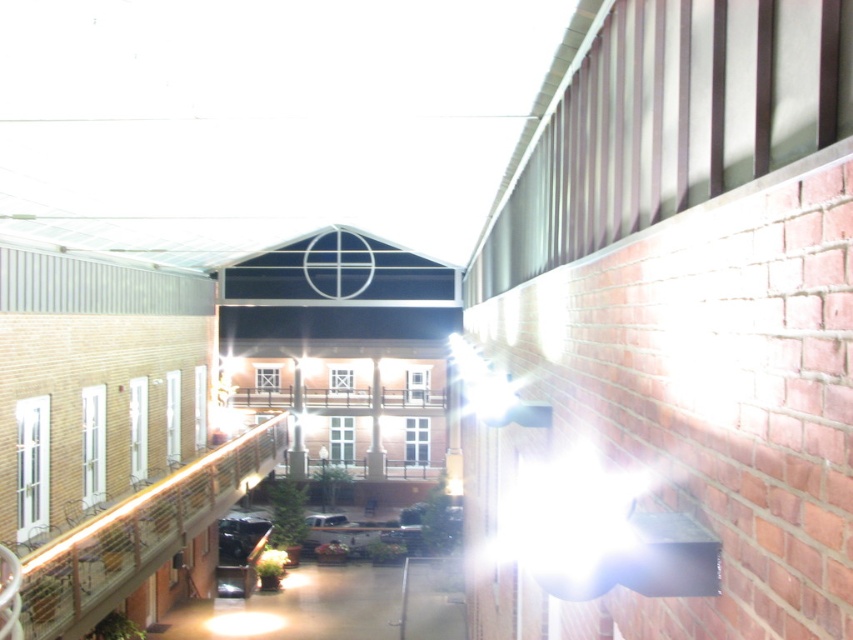
You are a photographer setting up a shot in the corridor. You want to capture both the shiny black car at lower left and the metallic silver car at center in your frame. Which car should you focus on if you want to highlight the one that appears larger in the photo?

The shiny black car at lower left is much taller than the metallic silver car at center, so focusing on the shiny black car at lower left will highlight the larger one in the photo.

You are a delivery person trying to park your truck in the corridor. The shiny black car at lower left and the metallic silver car at center are blocking the way. Which car should you move first to create more space for your truck?

You should move the metallic silver car at center first because its width is greater than the shiny black car at lower left, so removing it will free up more space for your truck.